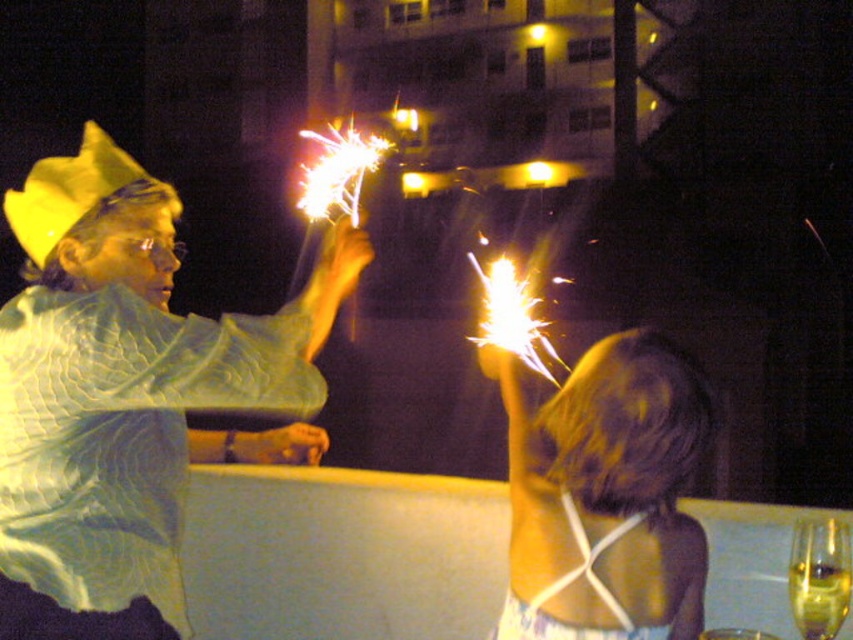
Can you confirm if matte green fabric at left is wider than blonde hair at upper right?

Yes.

Consider the image. Which of these two, matte green fabric at left or blonde hair at upper right, stands taller?

With more height is matte green fabric at left.

This screenshot has height=640, width=853. Identify the location of matte green fabric at left. (132, 381).